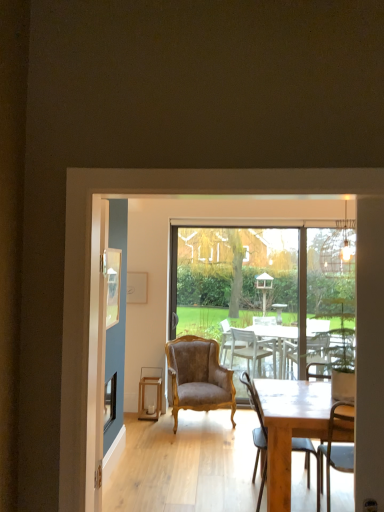
Question: Is wooden stool at center directly adjacent to brown velvet armchair at center, the second chair from the front?

Choices:
 (A) yes
 (B) no

Answer: (B)

Question: Is wooden stool at center behind brown velvet armchair at center, the second chair from the front?

Choices:
 (A) yes
 (B) no

Answer: (A)

Question: From the image's perspective, would you say wooden stool at center is positioned over brown velvet armchair at center, the second chair from the front?

Choices:
 (A) no
 (B) yes

Answer: (A)

Question: Is brown velvet armchair at center, the 2th chair viewed from the right, at the back of wooden stool at center?

Choices:
 (A) yes
 (B) no

Answer: (B)

Question: Does wooden stool at center turn towards brown velvet armchair at center, the second chair from the front?

Choices:
 (A) yes
 (B) no

Answer: (B)

Question: In the image, is wooden picture frame at upper left positioned in front of or behind transparent glass window screen at center?

Choices:
 (A) behind
 (B) front

Answer: (B)

Question: Is wooden picture frame at upper left situated inside transparent glass window screen at center or outside?

Choices:
 (A) inside
 (B) outside

Answer: (B)

Question: From a real-world perspective, is wooden picture frame at upper left positioned above or below transparent glass window screen at center?

Choices:
 (A) below
 (B) above

Answer: (B)

Question: From the image's perspective, relative to transparent glass window screen at center, is wooden picture frame at upper left above or below?

Choices:
 (A) above
 (B) below

Answer: (A)

Question: Is wooden stool at center bigger or smaller than transparent glass window screen at center?

Choices:
 (A) small
 (B) big

Answer: (A)

Question: From a real-world perspective, is wooden stool at center physically located above or below transparent glass window screen at center?

Choices:
 (A) above
 (B) below

Answer: (B)

Question: Is wooden stool at center wider or thinner than transparent glass window screen at center?

Choices:
 (A) wide
 (B) thin

Answer: (A)

Question: Considering their positions, is wooden stool at center located in front of or behind transparent glass window screen at center?

Choices:
 (A) behind
 (B) front

Answer: (B)

Question: Which is correct: transparent glass screen door at center is inside brown velvet armchair at center, the 1th chair in the left-to-right sequence, or outside of it?

Choices:
 (A) outside
 (B) inside

Answer: (A)

Question: In the image, is transparent glass screen door at center positioned in front of or behind brown velvet armchair at center, the 2th chair viewed from the right?

Choices:
 (A) front
 (B) behind

Answer: (A)